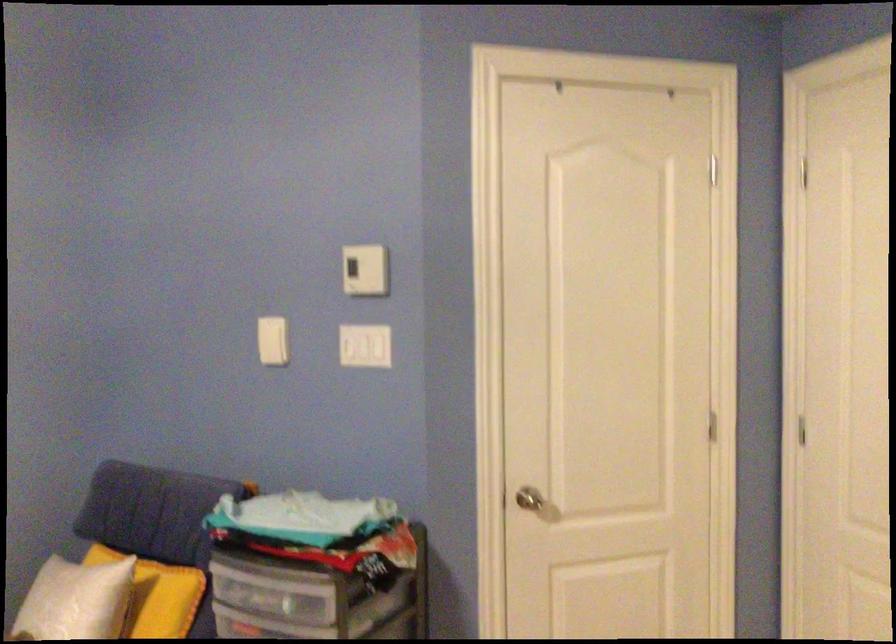
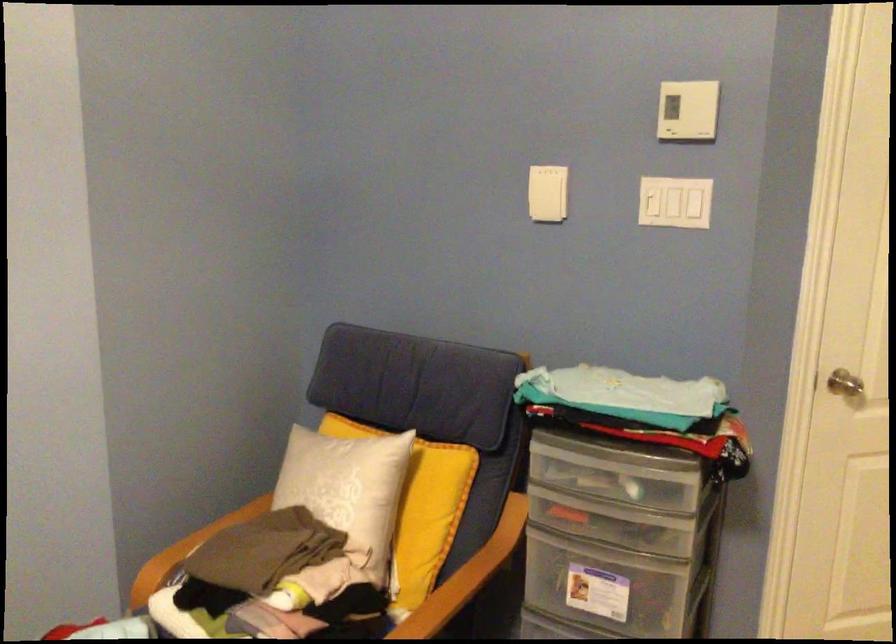
The point at (362, 346) is marked in the first image. Where is the corresponding point in the second image?

(675, 202)